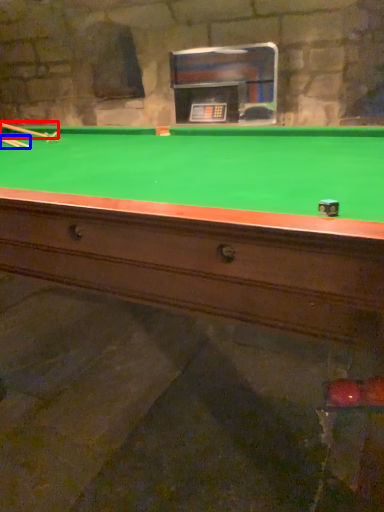
Question: Which point is closer to the camera, cue (highlighted by a red box) or cue (highlighted by a blue box)?

Choices:
 (A) cue
 (B) cue

Answer: (B)